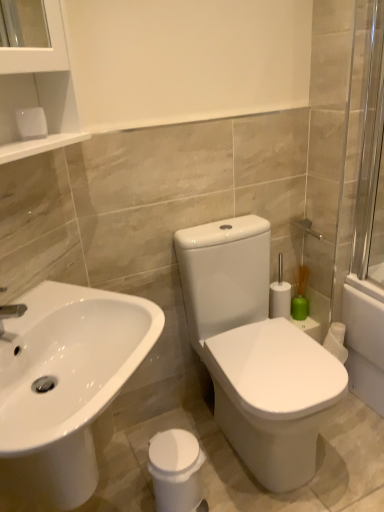
Find the location of `vacant region to the left of white glossy trash can at lower center`. vacant region to the left of white glossy trash can at lower center is located at coordinates (134, 484).